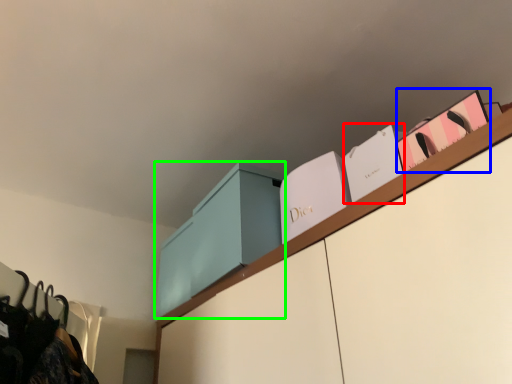
Question: Based on their relative distances, which object is nearer to book (highlighted by a red box)? Choose from book (highlighted by a blue box) and cabinetry (highlighted by a green box).

Choices:
 (A) book
 (B) cabinetry

Answer: (A)